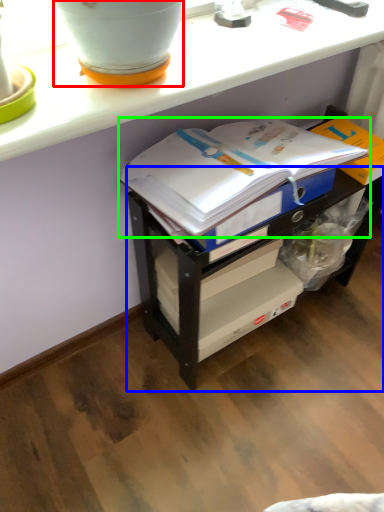
Question: Which is farther away from flowerpot (highlighted by a red box)? shelf (highlighted by a blue box) or journal (highlighted by a green box)?

Choices:
 (A) shelf
 (B) journal

Answer: (A)